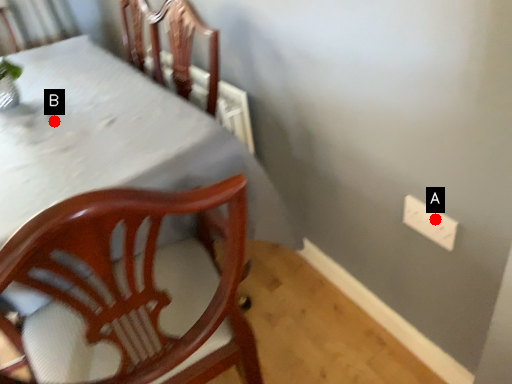
Question: Two points are circled on the image, labeled by A and B beside each circle. Which point is further to the camera?

Choices:
 (A) A is further
 (B) B is further

Answer: (B)